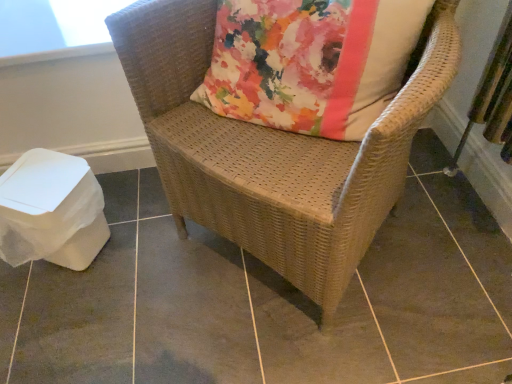
Question: From the image's perspective, is woven wicker chair at center above brown woven chair at center?

Choices:
 (A) no
 (B) yes

Answer: (B)

Question: Is brown woven chair at center a part of woven wicker chair at center?

Choices:
 (A) yes
 (B) no

Answer: (B)

Question: Does woven wicker chair at center have a greater height compared to brown woven chair at center?

Choices:
 (A) yes
 (B) no

Answer: (A)

Question: Does woven wicker chair at center come behind brown woven chair at center?

Choices:
 (A) yes
 (B) no

Answer: (B)

Question: Does woven wicker chair at center have a larger size compared to brown woven chair at center?

Choices:
 (A) no
 (B) yes

Answer: (B)

Question: In terms of height, does woven wicker chair at center look taller or shorter compared to transparent plastic window screen at upper left?

Choices:
 (A) short
 (B) tall

Answer: (B)

Question: From a real-world perspective, is woven wicker chair at center above or below transparent plastic window screen at upper left?

Choices:
 (A) below
 (B) above

Answer: (A)

Question: Does point (179, 221) appear closer or farther from the camera than point (71, 24)?

Choices:
 (A) farther
 (B) closer

Answer: (A)

Question: From the image's perspective, is woven wicker chair at center located above or below transparent plastic window screen at upper left?

Choices:
 (A) below
 (B) above

Answer: (A)

Question: Is brown woven chair at center wider or thinner than woven wicker chair at center?

Choices:
 (A) thin
 (B) wide

Answer: (B)

Question: Is brown woven chair at center in front of or behind woven wicker chair at center in the image?

Choices:
 (A) front
 (B) behind

Answer: (B)

Question: From a real-world perspective, is brown woven chair at center physically located above or below woven wicker chair at center?

Choices:
 (A) below
 (B) above

Answer: (A)

Question: Is brown woven chair at center bigger or smaller than woven wicker chair at center?

Choices:
 (A) small
 (B) big

Answer: (A)

Question: In the image, is woven wicker chair at center on the left side or the right side of brown woven chair at center?

Choices:
 (A) right
 (B) left

Answer: (A)

Question: From the image's perspective, is woven wicker chair at center above or below brown woven chair at center?

Choices:
 (A) above
 (B) below

Answer: (A)